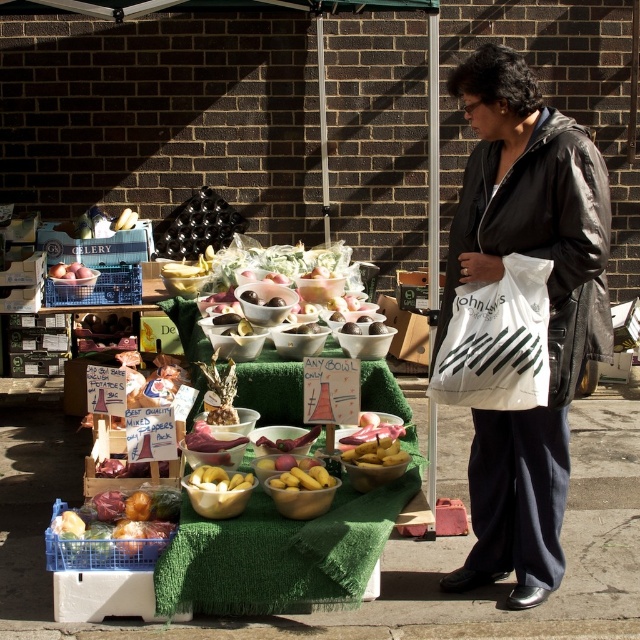
You are a customer at the market and want to grab both the white plastic bag at center and the smooth brown apples at left. Which one do you need to move first to access the other?

The white plastic bag at center is in front of the smooth brown apples at left, so you need to move the white plastic bag at center first to access the smooth brown apples at left.

You are a customer at the outdoor market. You want to buy the shiny black jacket at right. Where should you look on the table?

The shiny black jacket at right is located at point 0.484 on the x axis and 0.859 on the y axis of the table.